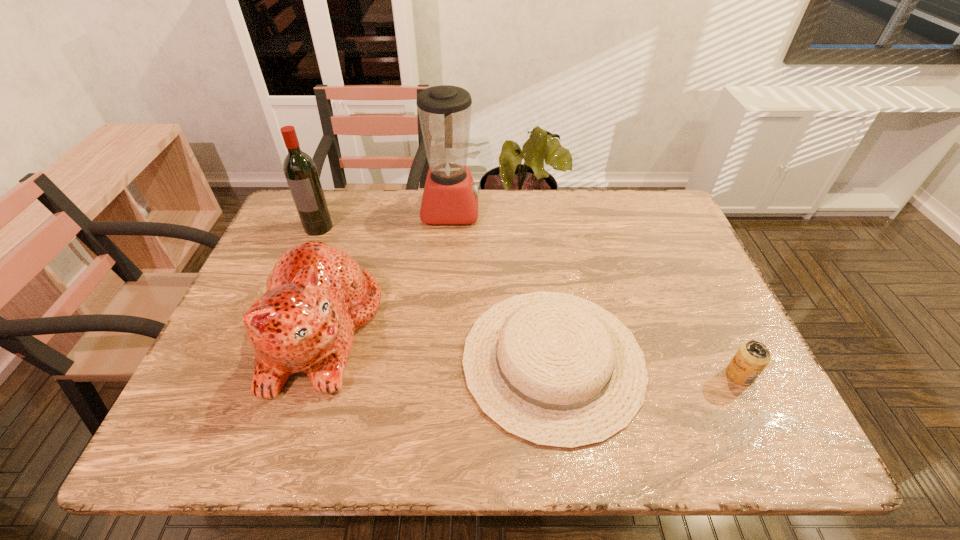
I want to click on blender, so click(450, 196).

The width and height of the screenshot is (960, 540). What are the coordinates of `wine bottle` in the screenshot? It's located at (300, 170).

Locate an element on the screen. The image size is (960, 540). the third tallest object is located at coordinates (317, 296).

Identify the location of the second shortest object. (752, 357).

The width and height of the screenshot is (960, 540). What are the coordinates of `beer can` in the screenshot? It's located at click(752, 357).

The width and height of the screenshot is (960, 540). I want to click on sunhat, so click(556, 370).

Identify the location of vacant space positioned 0.190m on the front of the blender near the controls. The image size is (960, 540). (540, 210).

Image resolution: width=960 pixels, height=540 pixels. Find the location of `vacant space located on the label of the wine bottle`. vacant space located on the label of the wine bottle is located at coordinates (271, 342).

Find the location of `free region located 0.390m on the face of the cat`. free region located 0.390m on the face of the cat is located at coordinates (542, 330).

Where is `free space located on the back of the second shortest object`? This screenshot has width=960, height=540. free space located on the back of the second shortest object is located at coordinates [x=679, y=249].